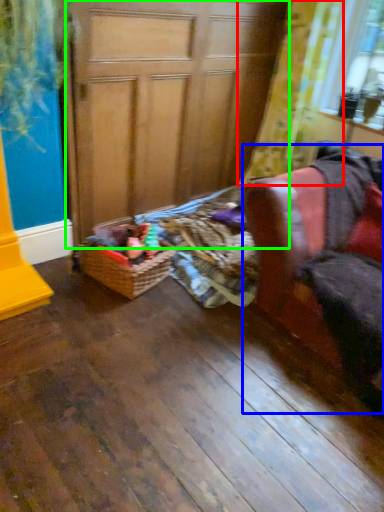
Question: Considering the real-world distances, which object is closest to curtain (highlighted by a red box)? armchair (highlighted by a blue box) or screen door (highlighted by a green box).

Choices:
 (A) armchair
 (B) screen door

Answer: (B)